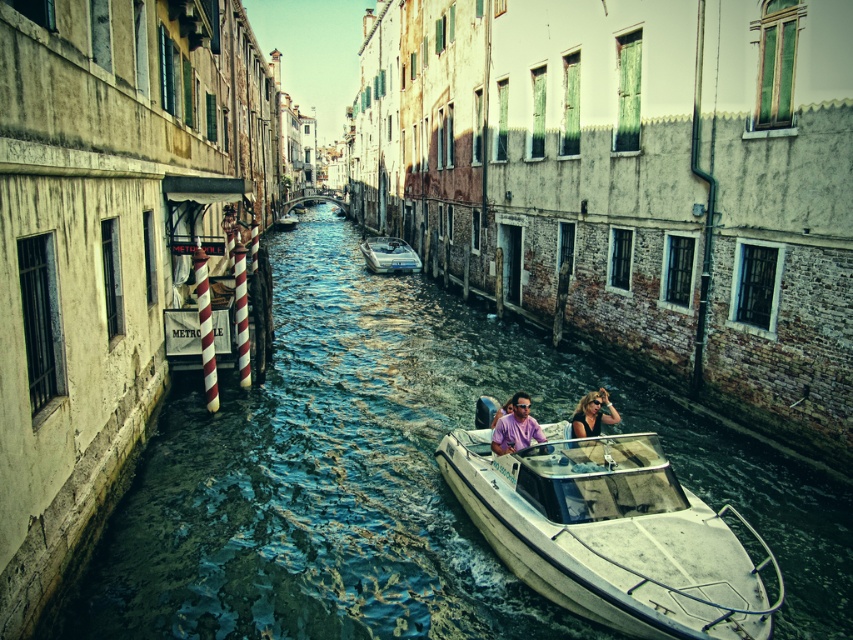
You are standing on the small bridge in the canal scene. You see a shiny metallic boat at center and a matte pink shirt at center. Which object is closer to you?

The shiny metallic boat at center is above the matte pink shirt at center, so it is closer to you.

You are standing on the small bridge and see both the shiny metallic boat at center and the metallic silver boat at center in the canal below. Which boat is closer to you?

The shiny metallic boat at center is closer to the viewer than the metallic silver boat at center, so the shiny metallic boat at center is closer to you.